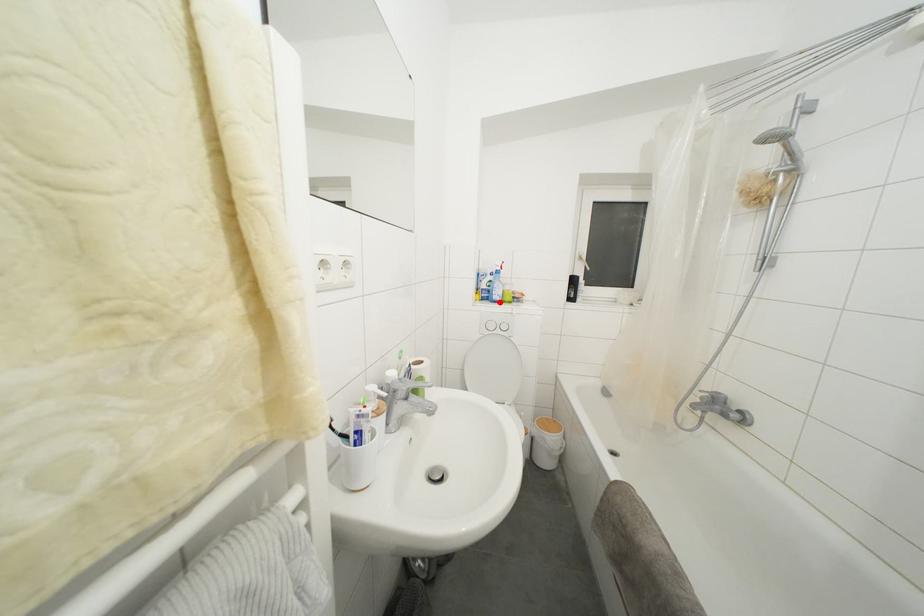
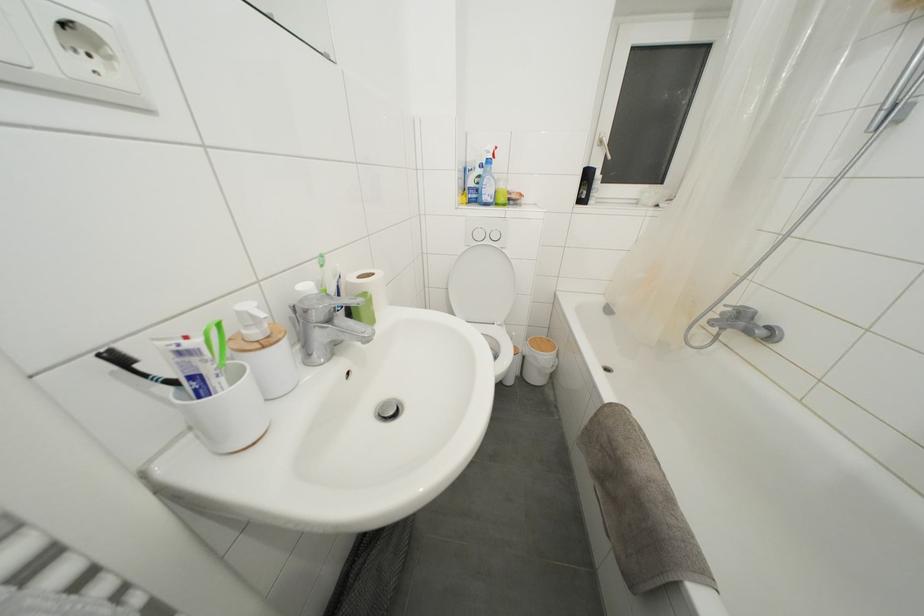
Locate, in the second image, the point that corresponds to the highlighted location in the first image.

(490, 203)